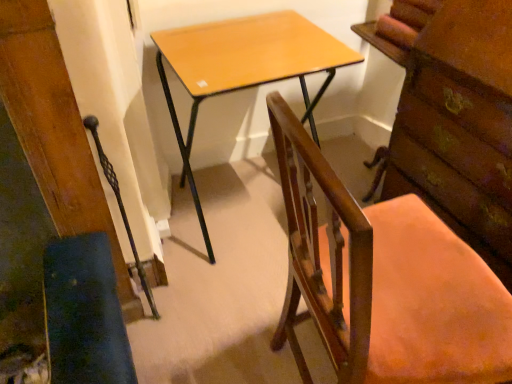
Question: Considering the relative positions of light brown wood desk at center and wooden chest of drawers at right in the image provided, is light brown wood desk at center to the left of wooden chest of drawers at right from the viewer's perspective?

Choices:
 (A) yes
 (B) no

Answer: (A)

Question: Is light brown wood desk at center not close to wooden chest of drawers at right?

Choices:
 (A) yes
 (B) no

Answer: (B)

Question: From the image's perspective, would you say light brown wood desk at center is positioned over wooden chest of drawers at right?

Choices:
 (A) no
 (B) yes

Answer: (A)

Question: From the image's perspective, is light brown wood desk at center beneath wooden chest of drawers at right?

Choices:
 (A) no
 (B) yes

Answer: (B)

Question: Is light brown wood desk at center to the right of wooden chest of drawers at right from the viewer's perspective?

Choices:
 (A) no
 (B) yes

Answer: (A)

Question: Considering the relative sizes of light brown wood desk at center and wooden chest of drawers at right in the image provided, is light brown wood desk at center taller than wooden chest of drawers at right?

Choices:
 (A) no
 (B) yes

Answer: (B)

Question: Could you tell me if wooden chest of drawers at right is turned towards wooden swivel chair at lower left?

Choices:
 (A) no
 (B) yes

Answer: (B)

Question: Is wooden chest of drawers at right closer to the viewer compared to wooden swivel chair at lower left?

Choices:
 (A) no
 (B) yes

Answer: (A)

Question: Does wooden chest of drawers at right appear on the right side of wooden swivel chair at lower left?

Choices:
 (A) yes
 (B) no

Answer: (A)

Question: Considering the relative sizes of wooden chest of drawers at right and wooden swivel chair at lower left in the image provided, is wooden chest of drawers at right shorter than wooden swivel chair at lower left?

Choices:
 (A) no
 (B) yes

Answer: (B)

Question: Is wooden chest of drawers at right positioned far away from wooden swivel chair at lower left?

Choices:
 (A) no
 (B) yes

Answer: (B)

Question: Can you confirm if wooden chest of drawers at right is taller than wooden swivel chair at lower left?

Choices:
 (A) yes
 (B) no

Answer: (B)

Question: Is light brown wood desk at center completely or partially inside wooden chair at center?

Choices:
 (A) yes
 (B) no

Answer: (B)